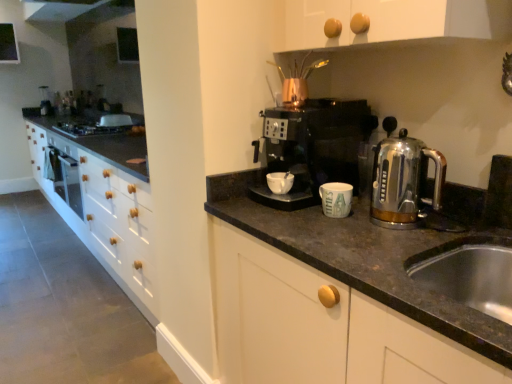
Describe the element at coordinates (45, 101) in the screenshot. I see `brushed metal coffee machine at upper center` at that location.

What do you see at coordinates (58, 9) in the screenshot?
I see `white glossy exhaust hood at upper center` at bounding box center [58, 9].

Locate an element on the screen. The image size is (512, 384). matte ceramic mug at center is located at coordinates (336, 199).

Consider the image. In order to face matte ceramic mug at center, should I rotate leftwards or rightwards?

To face it directly, rotate right by 10.275 degrees.

Locate an element on the screen. Image resolution: width=512 pixels, height=384 pixels. black glass gas stove at upper left is located at coordinates (88, 128).

In order to face white matte mug at center, should I rotate leftwards or rightwards?

Rotate right and turn 3.237 degrees.

Identify the location of black plastic coffee maker at center. (313, 148).

Is white matte mug at center inside or outside of brushed metal coffee machine at upper center?

white matte mug at center exists outside the volume of brushed metal coffee machine at upper center.

From a real-world perspective, between white matte mug at center and brushed metal coffee machine at upper center, who is vertically lower?

white matte mug at center is physically lower.

Can you confirm if white matte mug at center is smaller than brushed metal coffee machine at upper center?

Correct, white matte mug at center occupies less space than brushed metal coffee machine at upper center.

Which is closer to the camera, (58, 6) or (400, 227)?

The point (400, 227) is more forward.

Could you tell me if white glossy exhaust hood at upper center is turned towards satin chrome kettle at right?

No, white glossy exhaust hood at upper center is not aimed at satin chrome kettle at right.

Is satin chrome kettle at right surrounded by white glossy exhaust hood at upper center?

No, satin chrome kettle at right is not a part of white glossy exhaust hood at upper center.

From a real-world perspective, is white glossy exhaust hood at upper center physically above satin chrome kettle at right?

Correct, in the physical world, white glossy exhaust hood at upper center is higher than satin chrome kettle at right.

Does brushed metal coffee machine at upper center have a greater width compared to matte ceramic mug at center?

Correct, the width of brushed metal coffee machine at upper center exceeds that of matte ceramic mug at center.

Who is shorter, brushed metal coffee machine at upper center or matte ceramic mug at center?

With less height is matte ceramic mug at center.

Is the depth of brushed metal coffee machine at upper center greater than that of matte ceramic mug at center?

Yes, it is.

Which object is wider, stainless steel sink at lower right or white matte mug at center?

stainless steel sink at lower right is wider.

From the picture: Measure the distance between stainless steel sink at lower right and white matte mug at center.

stainless steel sink at lower right and white matte mug at center are 24.93 inches apart from each other.

In the image, is stainless steel sink at lower right positioned in front of or behind white matte mug at center?

Visually, stainless steel sink at lower right is located in front of white matte mug at center.

Is stainless steel sink at lower right touching white matte mug at center?

No, stainless steel sink at lower right is not next to white matte mug at center.

Is matte ceramic mug at center taller or shorter than black glass gas stove at upper left?

In the image, matte ceramic mug at center appears to be taller than black glass gas stove at upper left.

From the picture: Is matte ceramic mug at center far away from black glass gas stove at upper left?

matte ceramic mug at center is far away from black glass gas stove at upper left.

Is matte ceramic mug at center located outside black glass gas stove at upper left?

That's correct, matte ceramic mug at center is outside of black glass gas stove at upper left.

Considering the positions of point (343, 195) and point (91, 132), is point (343, 195) closer or farther from the camera than point (91, 132)?

Point (343, 195) is positioned closer to the camera compared to point (91, 132).

Locate an element on the screen. The height and width of the screenshot is (384, 512). coffee maker on the right of the black glass gas stove at upper left is located at coordinates (313, 148).

From the picture: From the image's perspective, is black plastic coffee maker at center located above black glass gas stove at upper left?

Incorrect, from the image's perspective, black plastic coffee maker at center is lower than black glass gas stove at upper left.

Looking at this image, can you tell me how much black plastic coffee maker at center and black glass gas stove at upper left differ in facing direction?

They differ by 0.763 degrees in their facing directions.

Is there a large distance between black plastic coffee maker at center and black glass gas stove at upper left?

Yes, black plastic coffee maker at center is far from black glass gas stove at upper left.

Could you tell me if matte ceramic mug at center is turned towards white matte mug at center?

No, matte ceramic mug at center is not facing towards white matte mug at center.

This screenshot has width=512, height=384. I want to click on mug to the left of matte ceramic mug at center, so click(x=280, y=182).

From a real-world perspective, does matte ceramic mug at center stand above white matte mug at center?

No, from a real-world perspective, matte ceramic mug at center is not on top of white matte mug at center.

Is matte ceramic mug at center spatially inside white matte mug at center, or outside of it?

Answer: matte ceramic mug at center cannot be found inside white matte mug at center.

The image size is (512, 384). In order to click on mug located below the brushed metal coffee machine at upper center (from the image's perspective) in this screenshot , I will do `click(280, 182)`.

Locate an element on the screen. This screenshot has width=512, height=384. exhaust hood that is above the satin chrome kettle at right (from a real-world perspective) is located at coordinates (58, 9).

Which object lies nearer to the anchor point white matte mug at center, black plastic coffee maker at center or brushed metal coffee machine at upper center?

black plastic coffee maker at center is positioned closer to the anchor white matte mug at center.

Which object lies further to the anchor point matte ceramic mug at center, white matte mug at center or white glossy exhaust hood at upper center?

The object further to matte ceramic mug at center is white glossy exhaust hood at upper center.

Which object lies further to the anchor point satin chrome kettle at right, stainless steel sink at lower right or black plastic coffee maker at center?

Based on the image, stainless steel sink at lower right appears to be further to satin chrome kettle at right.

When comparing their distances from black plastic coffee maker at center, does black glass gas stove at upper left or stainless steel sink at lower right seem closer?

Based on the image, stainless steel sink at lower right appears to be nearer to black plastic coffee maker at center.

When comparing their distances from brushed metal coffee machine at upper center, does black plastic coffee maker at center or satin chrome kettle at right seem closer?

The object closer to brushed metal coffee machine at upper center is black plastic coffee maker at center.

Considering their positions, is black plastic coffee maker at center positioned closer to satin chrome kettle at right than black glass gas stove at upper left?

The object closer to satin chrome kettle at right is black plastic coffee maker at center.

Looking at the image, which one is located closer to stainless steel sink at lower right, brushed metal coffee machine at upper center or satin chrome kettle at right?

satin chrome kettle at right lies closer to stainless steel sink at lower right than the other object.

Based on the photo, from the image, which object appears to be nearer to matte ceramic mug at center, satin chrome kettle at right or brushed metal coffee machine at upper center?

satin chrome kettle at right is closer to matte ceramic mug at center.

Find the location of a particular element. The width and height of the screenshot is (512, 384). coffee maker located between matte ceramic mug at center and brushed metal coffee machine at upper center in the depth direction is located at coordinates pyautogui.click(x=313, y=148).

At what (x,y) coordinates should I click in order to perform the action: click on mug between white glossy exhaust hood at upper center and black plastic coffee maker at center in the horizontal direction. Please return your answer as a coordinate pair (x, y). Image resolution: width=512 pixels, height=384 pixels. Looking at the image, I should click on (280, 182).

Where is `mug located between matte ceramic mug at center and brushed metal coffee machine at upper center in the depth direction`? Image resolution: width=512 pixels, height=384 pixels. mug located between matte ceramic mug at center and brushed metal coffee machine at upper center in the depth direction is located at coordinates (280, 182).

Where is `gas stove situated between white glossy exhaust hood at upper center and black plastic coffee maker at center from left to right`? This screenshot has height=384, width=512. gas stove situated between white glossy exhaust hood at upper center and black plastic coffee maker at center from left to right is located at coordinates (88, 128).